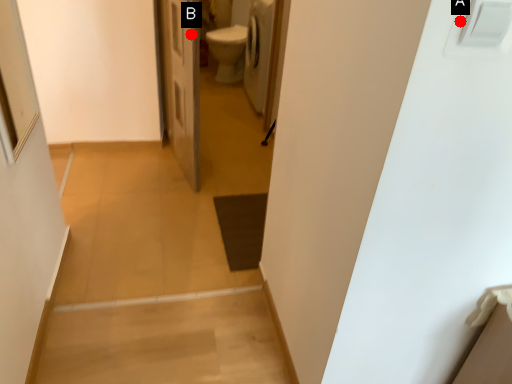
Question: Two points are circled on the image, labeled by A and B beside each circle. Which point is closer to the camera?

Choices:
 (A) A is closer
 (B) B is closer

Answer: (A)